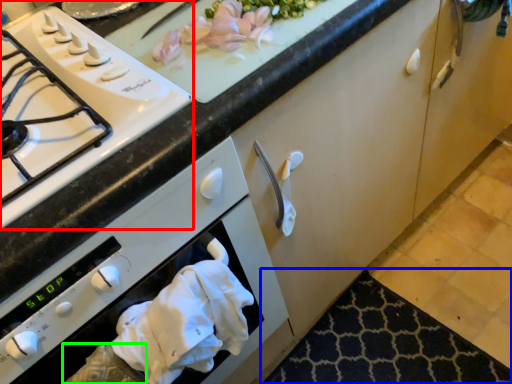
Question: Estimate the real-world distances between objects in this image. Which object is closer to gas stove (highlighted by a red box), mat (highlighted by a blue box) or hand (highlighted by a green box)?

Choices:
 (A) mat
 (B) hand

Answer: (B)